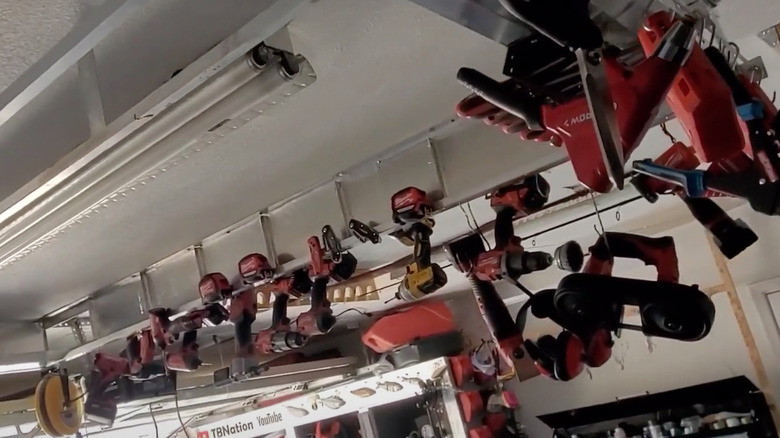
The width and height of the screenshot is (780, 438). Find the location of `white wall`. white wall is located at coordinates (702, 358).